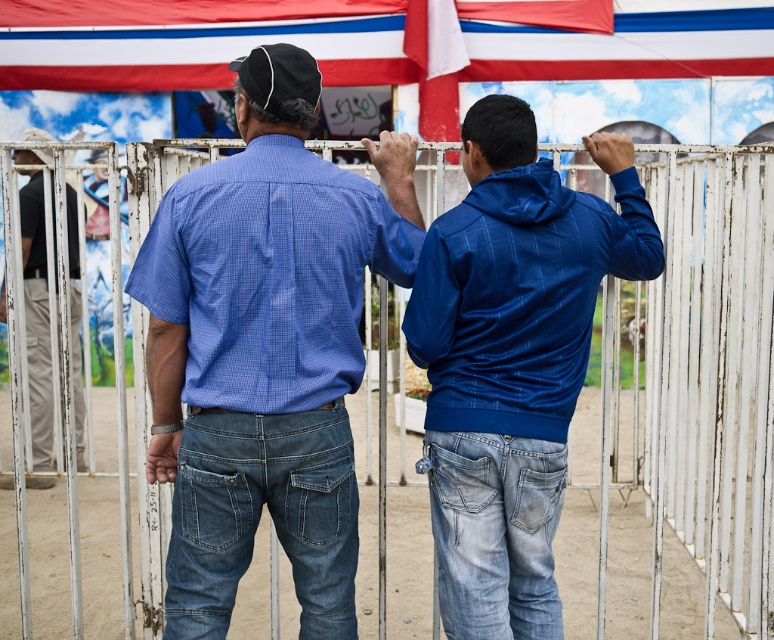
You are a photographer trying to capture a clear shot of the blue pinstriped hoodie at center and the khaki pants at left. Since you want to focus on the smaller object, which one should you zoom in on?

The blue pinstriped hoodie at center is smaller than the khaki pants at left, so you should zoom in on the blue pinstriped hoodie at center to focus on the smaller object.

You are a photographer trying to capture a closeup of the matte blue shirt at center. Given that your camera has a focal length of 50mm and you are currently 3 meters away from the shirt, will you be able to fill the frame with the shirt without moving closer?

The 2D location of matte blue shirt at center is at point (265,358), which indicates it is positioned centrally in the image. However, without knowing the shirt size or the camera sensor size, it is impossible to determine if the shirt will fill the frame at 50mm and 3 meters distance. More information is needed.